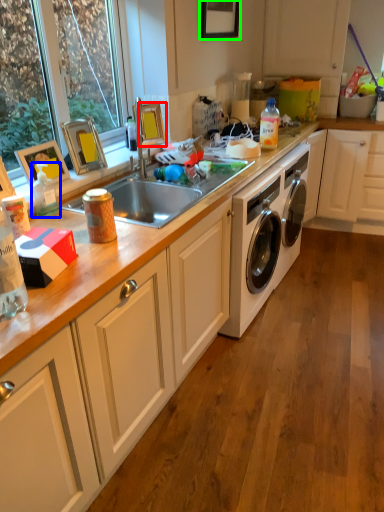
Question: Considering the real-world distances, which object is closest to picture frame (highlighted by a red box)? bottle (highlighted by a blue box) or picture frame (highlighted by a green box).

Choices:
 (A) bottle
 (B) picture frame

Answer: (B)